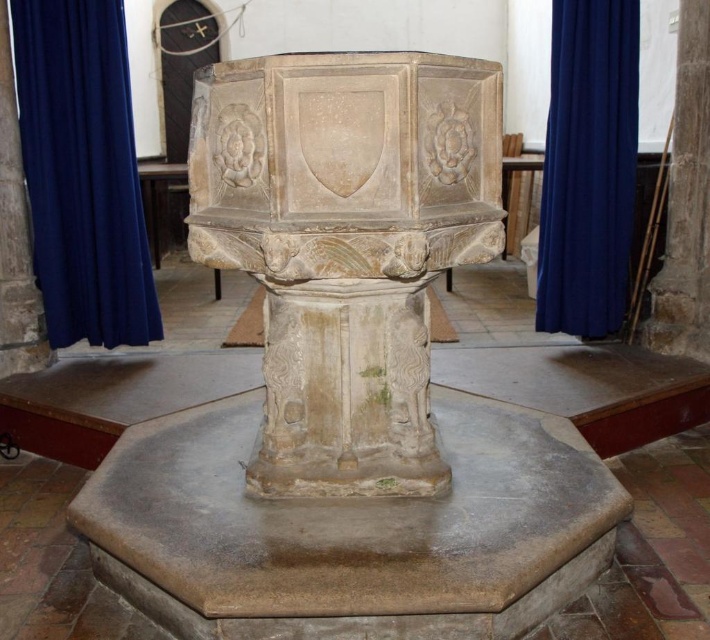
Question: Can you confirm if blue fabric curtain at left is positioned to the left of blue fabric curtain at right?

Choices:
 (A) yes
 (B) no

Answer: (A)

Question: Which is nearer to the stone carved baptismal font at center?

Choices:
 (A) blue fabric curtain at right
 (B) blue fabric curtain at left

Answer: (B)

Question: Which object is farther from the camera taking this photo?

Choices:
 (A) stone carved baptismal font at center
 (B) blue fabric curtain at right
 (C) blue fabric curtain at left

Answer: (B)

Question: Among these objects, which one is nearest to the camera?

Choices:
 (A) stone carved baptismal font at center
 (B) blue fabric curtain at right

Answer: (A)

Question: Observing the image, what is the correct spatial positioning of blue fabric curtain at left in reference to blue fabric curtain at right?

Choices:
 (A) below
 (B) above

Answer: (A)

Question: Does stone carved baptismal font at center appear on the right side of blue fabric curtain at left?

Choices:
 (A) no
 (B) yes

Answer: (B)